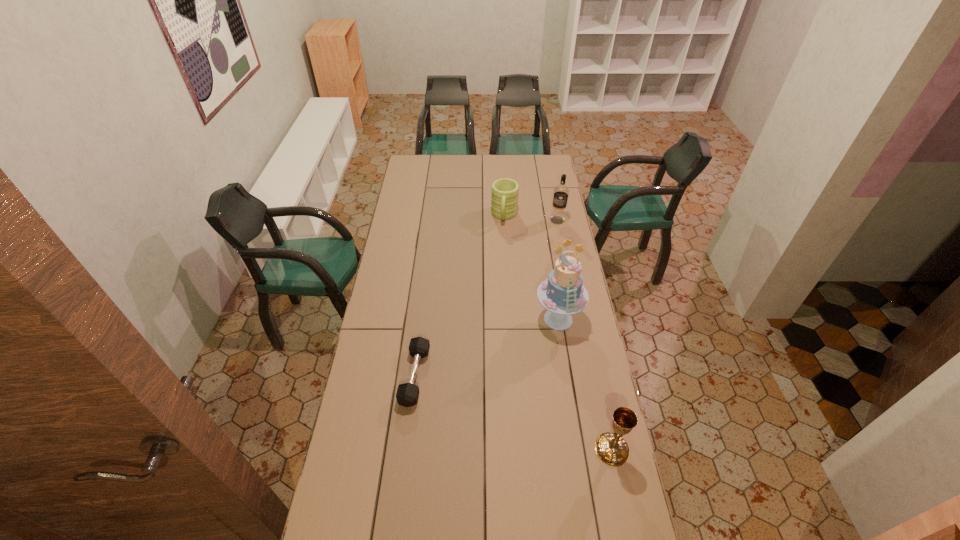
Where is `vacant spot on the desktop that is between the leftmost object and the nearest object and is positioned with a ladder on the side of the cake`? This screenshot has height=540, width=960. vacant spot on the desktop that is between the leftmost object and the nearest object and is positioned with a ladder on the side of the cake is located at coordinates (528, 418).

At what (x,y) coordinates should I click in order to perform the action: click on vacant space on the desktop that is between the second nearest object and the nearest object and is positioned on the side of the second object from left to right with the handle. Please return your answer as a coordinate pair (x, y). This screenshot has height=540, width=960. Looking at the image, I should click on (479, 400).

Locate an element on the screen. The height and width of the screenshot is (540, 960). free space on the desktop that is between the second nearest object and the chalice and is positioned on the label of the fourth shortest object is located at coordinates (488, 403).